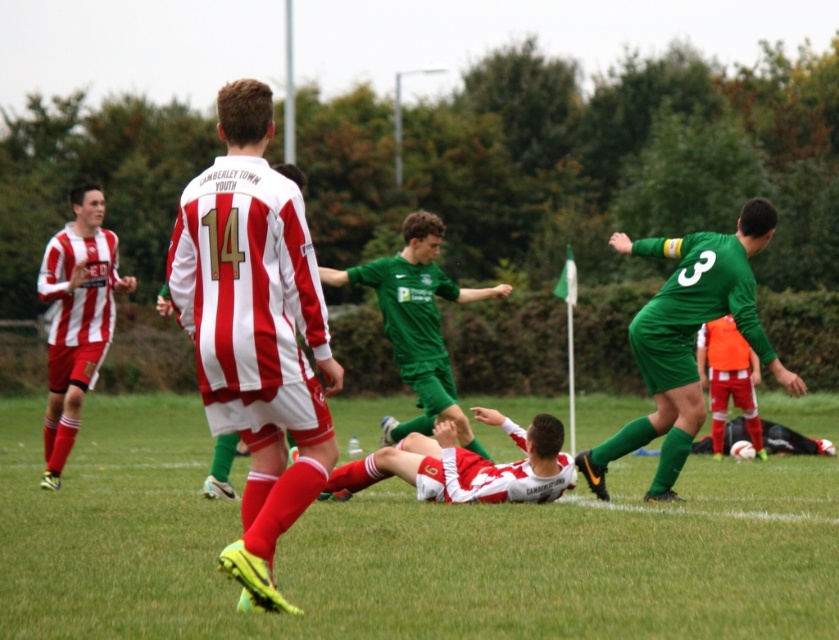
Based on the coordinates provided, where is the green jersey at center located in the image?

The green jersey at center is located at the center of the image, at coordinates point (417, 323).

You are a referee observing the soccer match. You notice the green jersey at center and the matte red and white jersey at center. Which player is on top in this situation?

The green jersey at center is positioned over the matte red and white jersey at center, indicating that the green jersey player is on top.